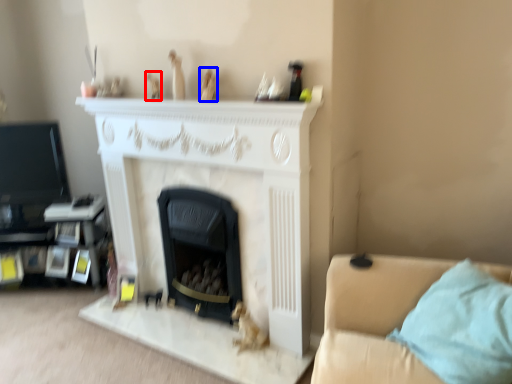
Question: Which object is closer to the camera taking this photo, toy (highlighted by a red box) or toy (highlighted by a blue box)?

Choices:
 (A) toy
 (B) toy

Answer: (B)